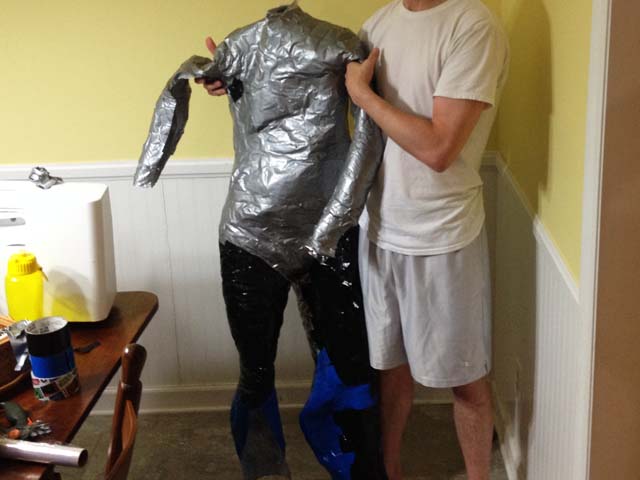
Locate an element on the screen. Image resolution: width=640 pixels, height=480 pixels. table is located at coordinates (106, 346).